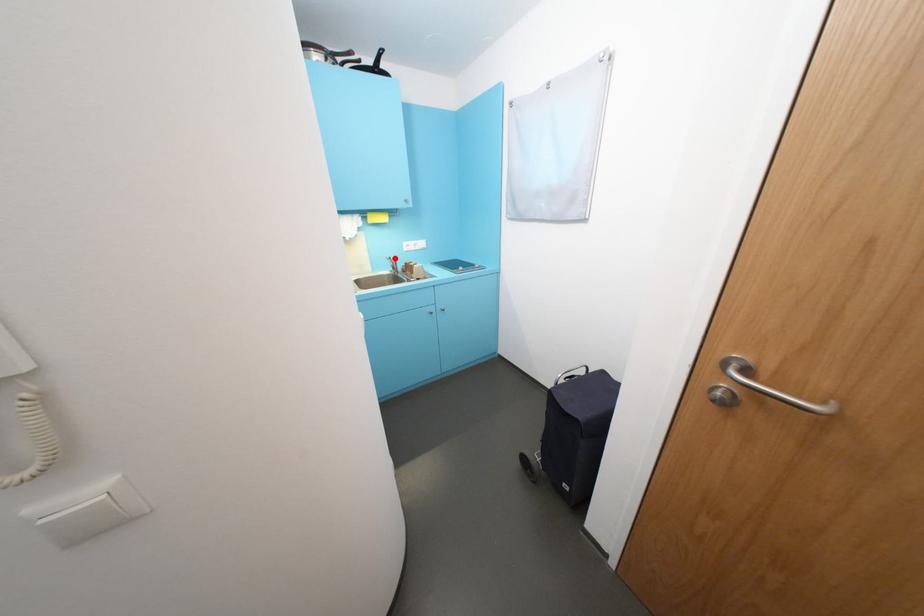
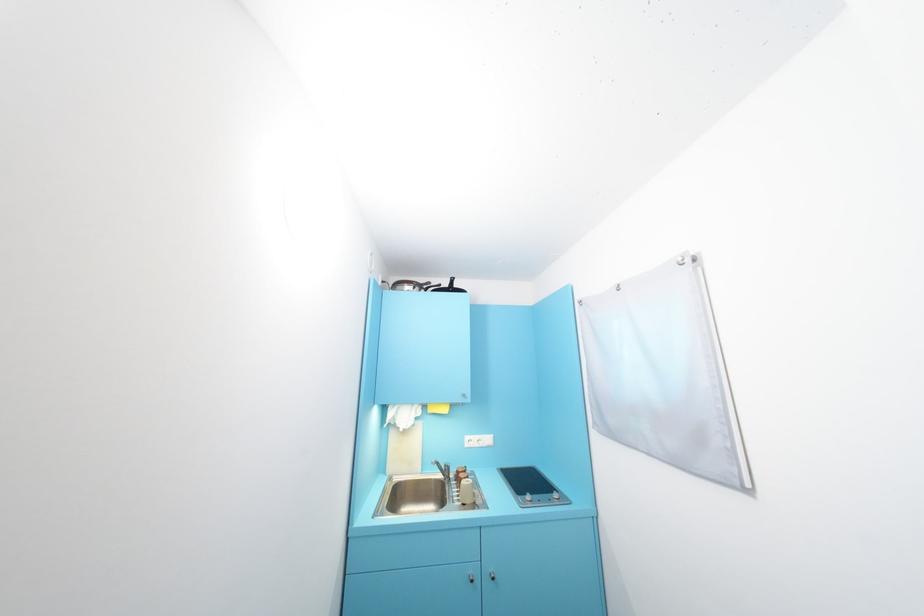
Question: I am providing you with two images of the same scene from different viewpoints. Image1 has a red point marked. In image2, the corresponding 3D location appears at what relative position? Reply with the corresponding letter.

Choices:
 (A) Closer
 (B) Farther

Answer: (B)